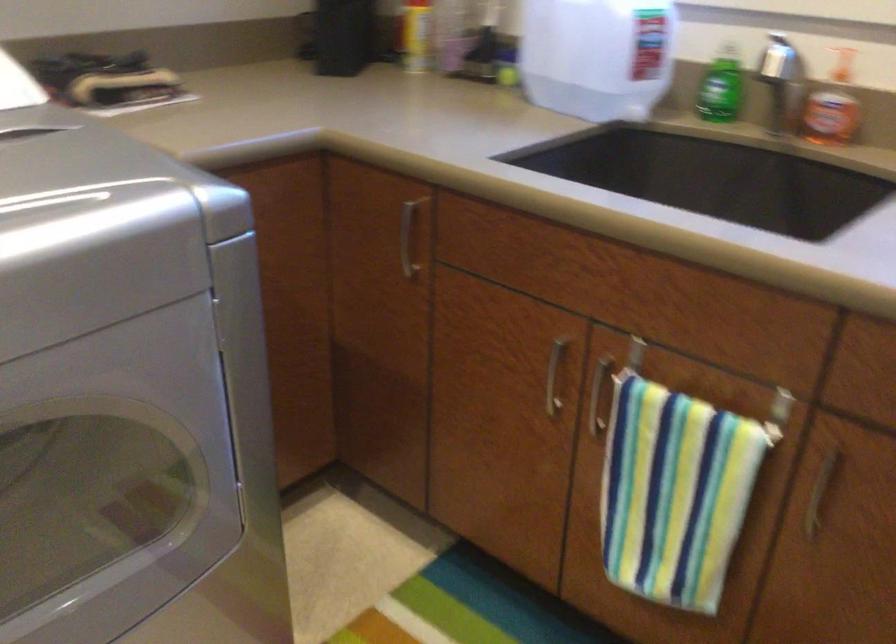
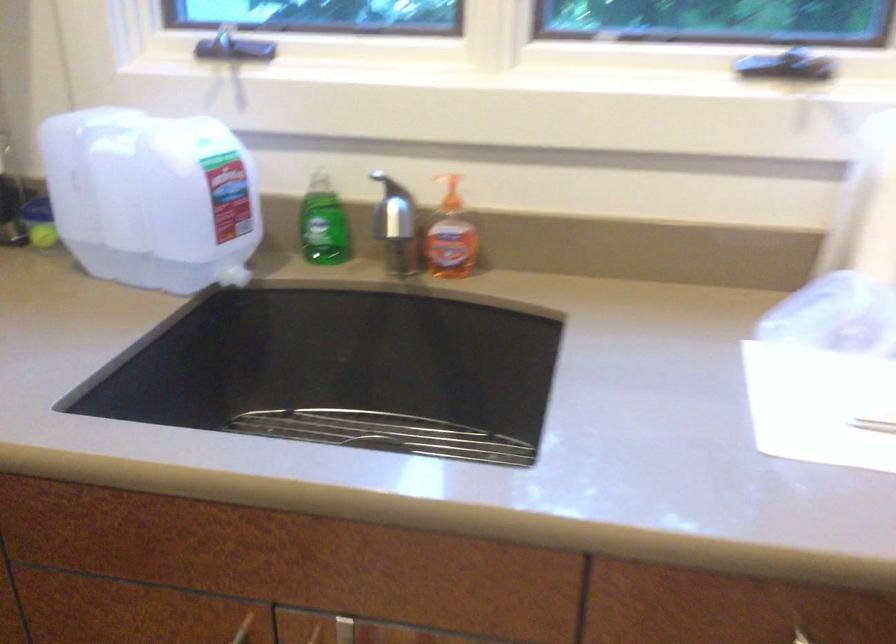
Locate, in the second image, the point that corresponds to (x=718, y=86) in the first image.

(323, 223)